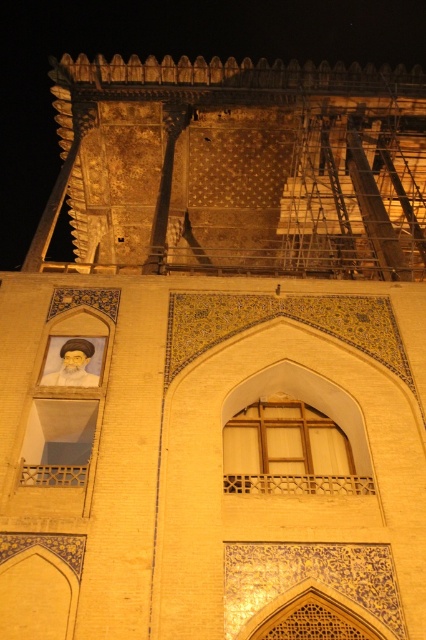
Can you confirm if gold mosaic wall at upper center is positioned to the left of white matte window at lower left?

Correct, you'll find gold mosaic wall at upper center to the left of white matte window at lower left.

What do you see at coordinates (160, 58) in the screenshot? The image size is (426, 640). I see `gold mosaic wall at upper center` at bounding box center [160, 58].

Where is `gold mosaic wall at upper center`? The width and height of the screenshot is (426, 640). gold mosaic wall at upper center is located at coordinates (160, 58).

Which of these two, gold mosaic wall at upper center or wooden at center, stands shorter?

With less height is wooden at center.

Is gold mosaic wall at upper center thinner than wooden at center?

Incorrect, gold mosaic wall at upper center's width is not less than wooden at center's.

This screenshot has width=426, height=640. I want to click on gold mosaic wall at upper center, so click(160, 58).

Is wooden at center bigger than white matte window at lower left?

Yes.

Does point (261, 458) come in front of point (45, 432)?

That is True.

The width and height of the screenshot is (426, 640). I want to click on wooden at center, so click(287, 451).